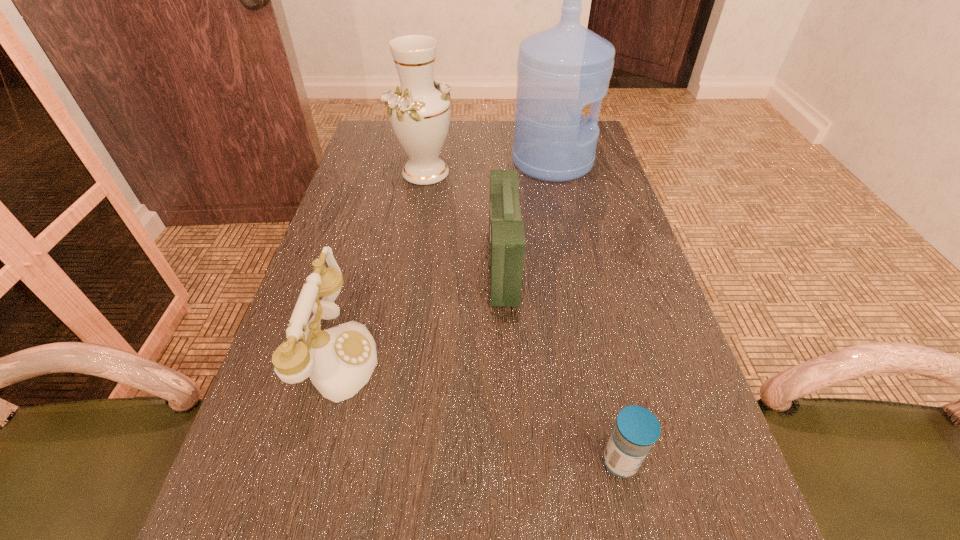
Locate an element on the screen. The height and width of the screenshot is (540, 960). free location that satisfies the following two spatial constraints: 1. on the front-facing side of the third object from left to right; 2. on the left side of the shortest object is located at coordinates (514, 461).

This screenshot has height=540, width=960. What are the coordinates of `vacant space that satisfies the following two spatial constraints: 1. on the dial of the telephone; 2. on the right side of the medicine` in the screenshot? It's located at (310, 461).

This screenshot has height=540, width=960. What are the coordinates of `vacant point that satisfies the following two spatial constraints: 1. on the front side of the vase; 2. on the dial of the telephone` in the screenshot? It's located at (396, 355).

Locate an element on the screen. Image resolution: width=960 pixels, height=540 pixels. vacant space that satisfies the following two spatial constraints: 1. on the dial of the shortest object; 2. on the right side of the telephone is located at coordinates (310, 461).